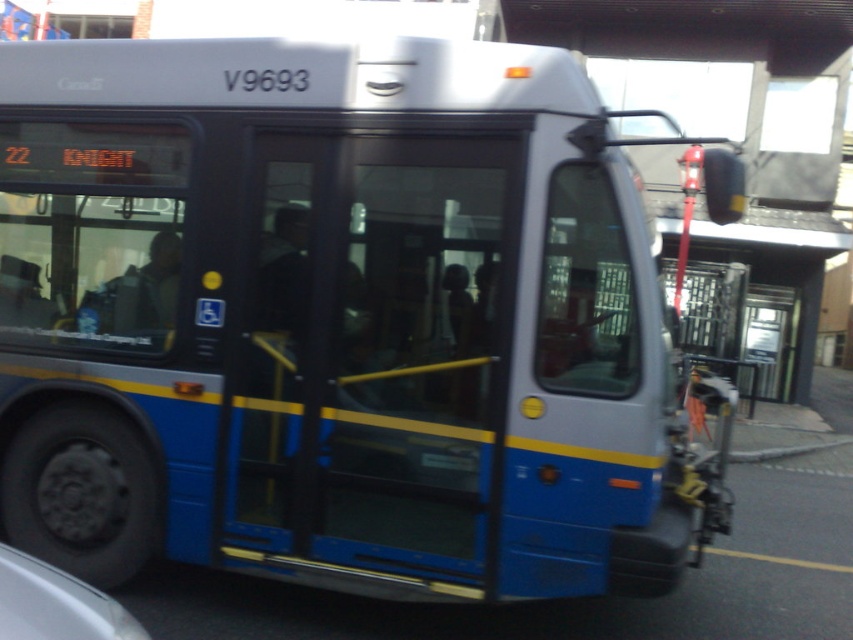
You are a delivery person standing near the blue metallic door at center of the bus. You need to place a package on a camera located 3.89 meters away. Can you reach the camera from your current position without moving?

The blue metallic door at center and camera are 3.89 meters apart. Since the distance is too far to reach without moving, you cannot place the package on the camera from your current position.

You are a passenger waiting to board the bus. You see the point marked at coordinates (376, 352). What object does this point correspond to?

The point at coordinates (376, 352) corresponds to the blue metallic door at center.

You are a delivery person who needs to load a 1.5 meter wide package onto the bus. The blue metallic door at center is the only entrance. Can the package fit through the door? Consider the white glossy car at lower left parked nearby for size comparison.

The blue metallic door at center has a width larger than the white glossy car at lower left. Since the car is typically wider than 1.5 meters, the package can fit through the door.